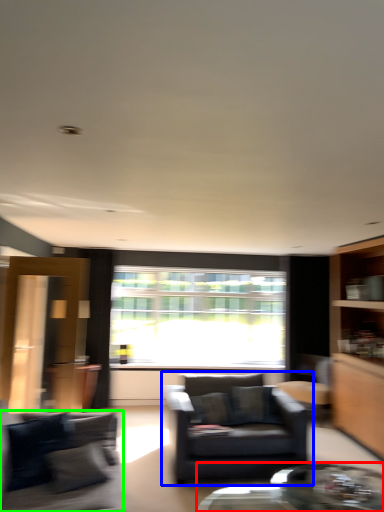
Question: Which object is positioned farthest from coffee table (highlighted by a red box)? Select from chair (highlighted by a blue box) and studio couch (highlighted by a green box).

Choices:
 (A) chair
 (B) studio couch

Answer: (B)